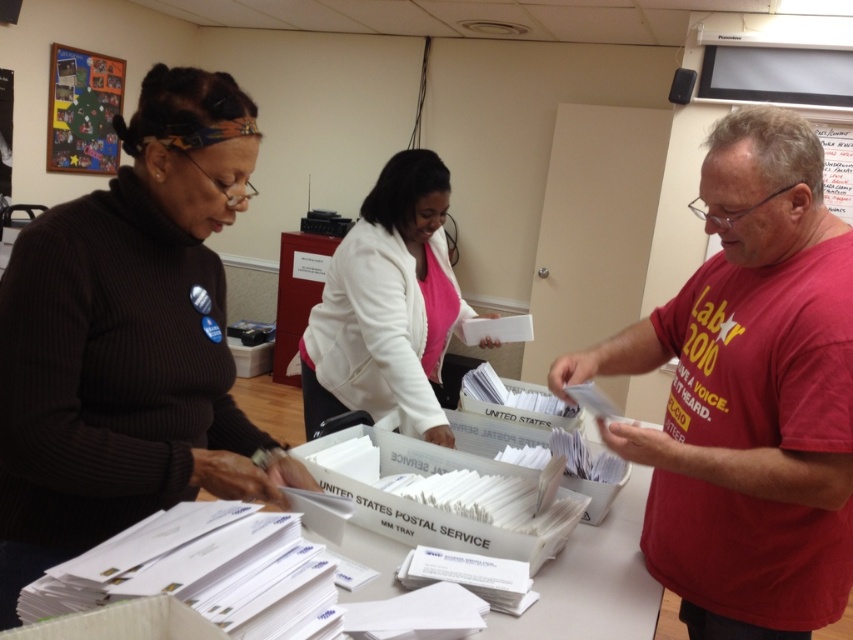
Which is below, ribbed brown sweater at left or red cotton t-shirt at center?

red cotton t-shirt at center is below.

Does point (19, 420) lie in front of point (735, 360)?

That is True.

Identify the location of ribbed brown sweater at left. Image resolution: width=853 pixels, height=640 pixels. (129, 339).

Consider the image. Can you confirm if ribbed brown sweater at left is smaller than white matte jacket at center?

Correct, ribbed brown sweater at left occupies less space than white matte jacket at center.

Is the position of ribbed brown sweater at left less distant than that of white matte jacket at center?

Yes.

Does point (4, 545) lie behind point (367, 374)?

No.

At what (x,y) coordinates should I click in order to perform the action: click on ribbed brown sweater at left. Please return your answer as a coordinate pair (x, y). This screenshot has width=853, height=640. Looking at the image, I should click on (129, 339).

Can you confirm if red cotton t-shirt at center is taller than white paper at center?

Yes, red cotton t-shirt at center is taller than white paper at center.

Between red cotton t-shirt at center and white paper at center, which one is positioned lower?

Positioned lower is white paper at center.

Image resolution: width=853 pixels, height=640 pixels. I want to click on red cotton t-shirt at center, so click(747, 396).